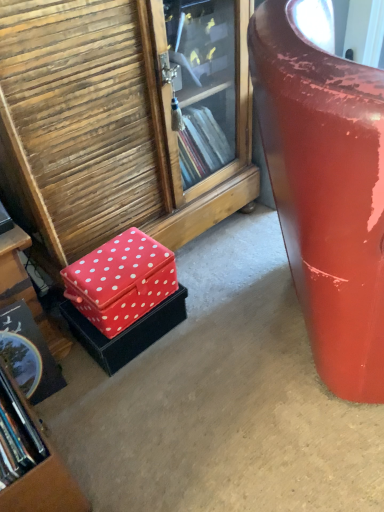
Question: Considering the relative positions of red fabric box at lower left and red fabric box at lower left, placed as the first box when sorted from top to bottom, in the image provided, is red fabric box at lower left to the left or to the right of red fabric box at lower left, placed as the first box when sorted from top to bottom,?

Choices:
 (A) right
 (B) left

Answer: (A)

Question: Is red fabric box at lower left wider or thinner than red fabric box at lower left, placed as the first box when sorted from top to bottom?

Choices:
 (A) wide
 (B) thin

Answer: (A)

Question: Estimate the real-world distances between objects in this image. Which object is farther from the wooden bookcase at lower left?

Choices:
 (A) red fabric box at lower left
 (B) glossy red suitcase at right
 (C) red fabric box at lower left, the 2th box positioned from the top
 (D) red fabric box at lower left, placed as the first box when sorted from top to bottom

Answer: (B)

Question: Estimate the real-world distances between objects in this image. Which object is farther from the red fabric box at lower left?

Choices:
 (A) wooden bookcase at lower left
 (B) red fabric box at lower left, placed as the first box when sorted from top to bottom
 (C) red fabric box at lower left, which ranks as the first box in bottom-to-top order
 (D) glossy red suitcase at right

Answer: (D)